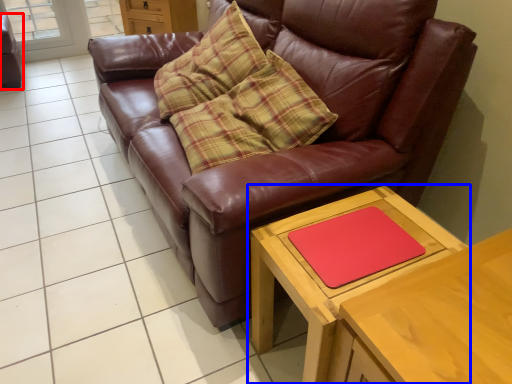
Question: Which of the following is the farthest to the observer, swivel chair (highlighted by a red box) or table (highlighted by a blue box)?

Choices:
 (A) swivel chair
 (B) table

Answer: (A)